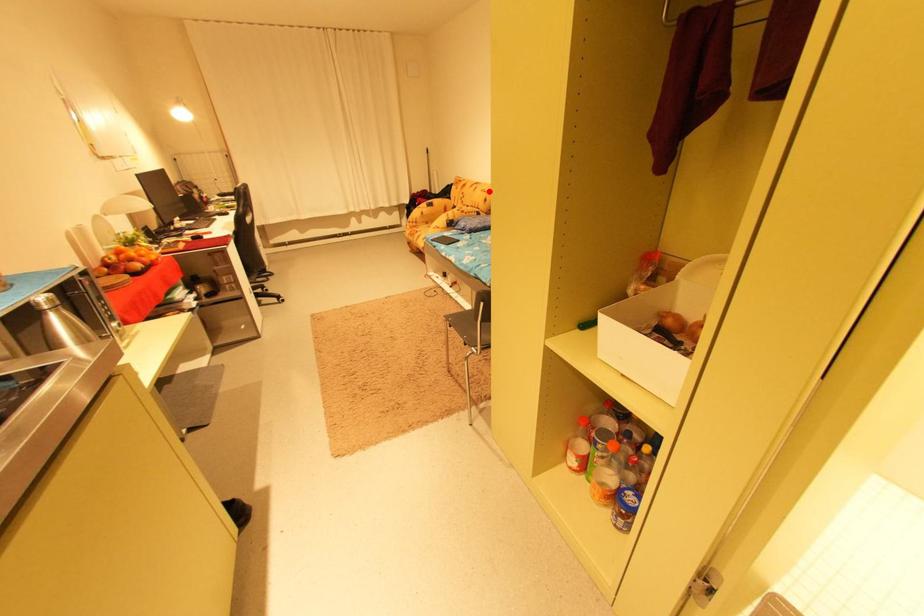
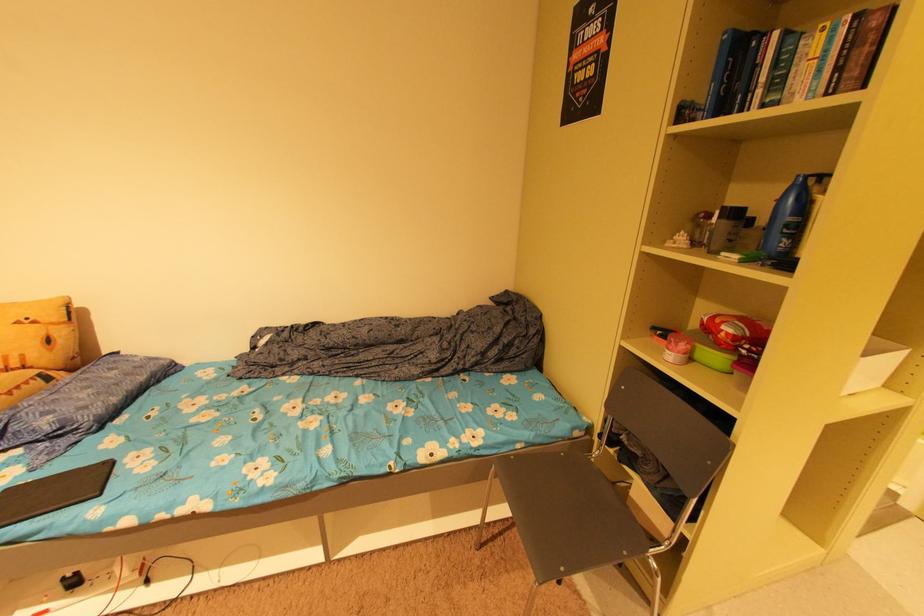
Question: I am providing you with two images of the same scene from different viewpoints. In image1, a red point is highlighted. Considering the same 3D point in image2, which of the following is correct?

Choices:
 (A) It is closer
 (B) It is farther

Answer: (B)